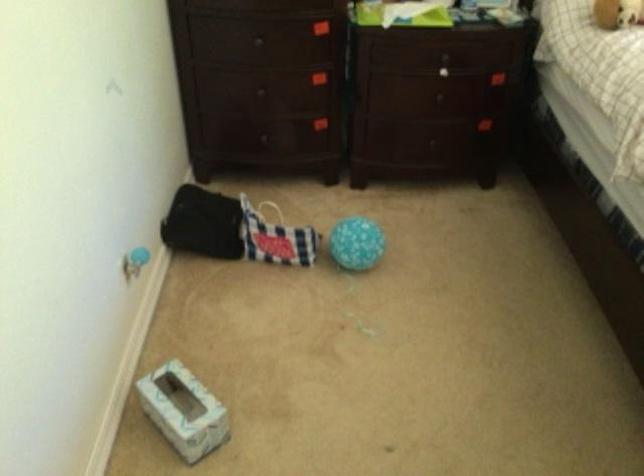
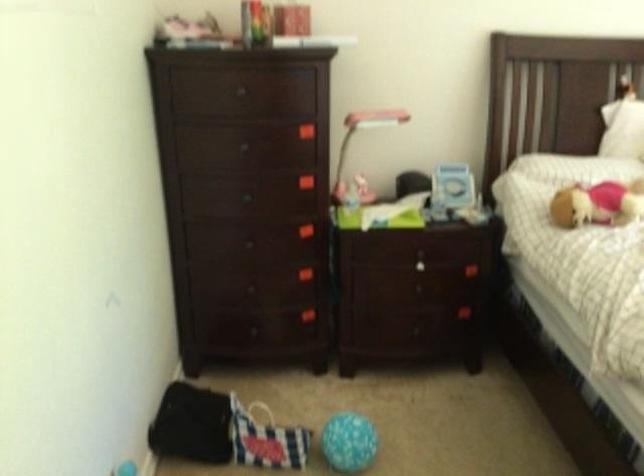
Question: The first image is from the beginning of the video and the second image is from the end. How did the camera likely rotate when shooting the video?

Choices:
 (A) Left
 (B) Right
 (C) Up
 (D) Down

Answer: (C)